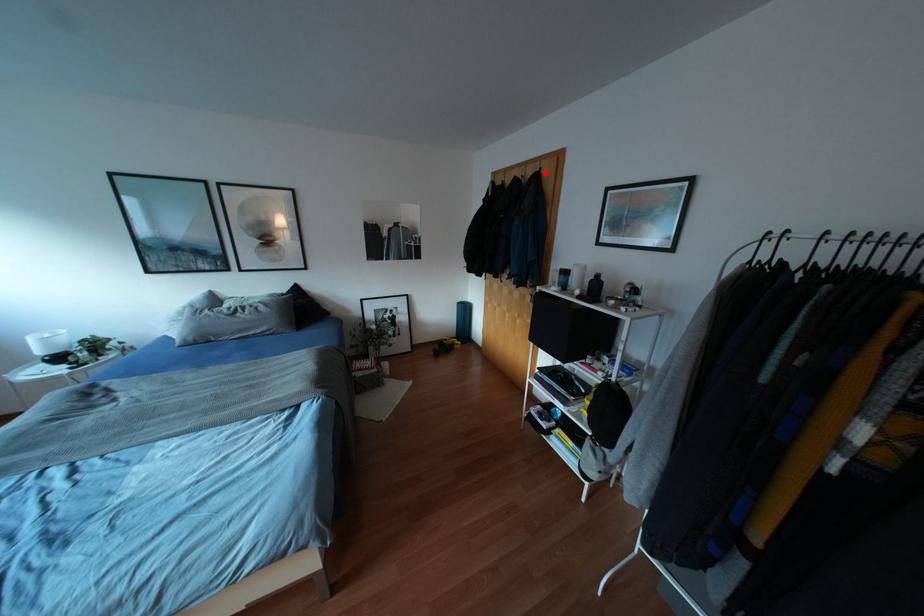
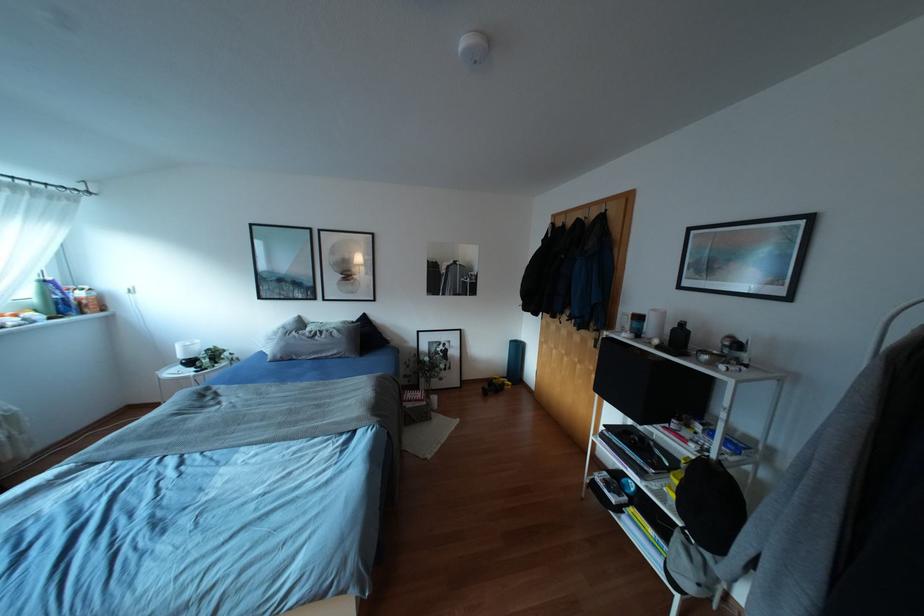
Find the pixel in the second image that matches the highlighted location in the first image.

(612, 214)